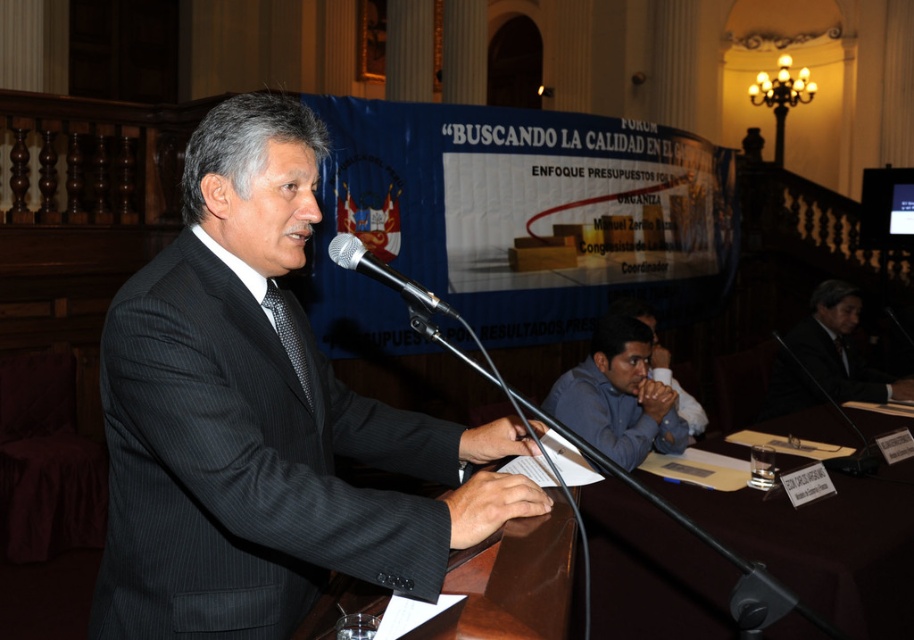
Between dark gray pinstripe suit at center and brown wooden table at center, which one has more height?

dark gray pinstripe suit at center is taller.

From the picture: Is dark gray pinstripe suit at center above brown wooden table at center?

Yes, dark gray pinstripe suit at center is above brown wooden table at center.

Between point (214, 225) and point (652, 561), which one is positioned behind?

Point (652, 561)

At what (x,y) coordinates should I click in order to perform the action: click on dark gray pinstripe suit at center. Please return your answer as a coordinate pair (x, y). This screenshot has height=640, width=914. Looking at the image, I should click on (261, 419).

Between black metallic microphone at center and blue shirt at lower right, which one appears on the left side from the viewer's perspective?

Positioned to the left is black metallic microphone at center.

Is point (410, 280) positioned after point (679, 385)?

No, it is not.

Find the location of `black metallic microphone at center`. black metallic microphone at center is located at coordinates (390, 282).

Can you confirm if blue cotton shirt at center is shorter than black metallic microphone at center?

No, blue cotton shirt at center is not shorter than black metallic microphone at center.

Is blue cotton shirt at center to the right of black metallic microphone at center from the viewer's perspective?

Yes, blue cotton shirt at center is to the right of black metallic microphone at center.

Where is `blue cotton shirt at center`? blue cotton shirt at center is located at coordinates (619, 396).